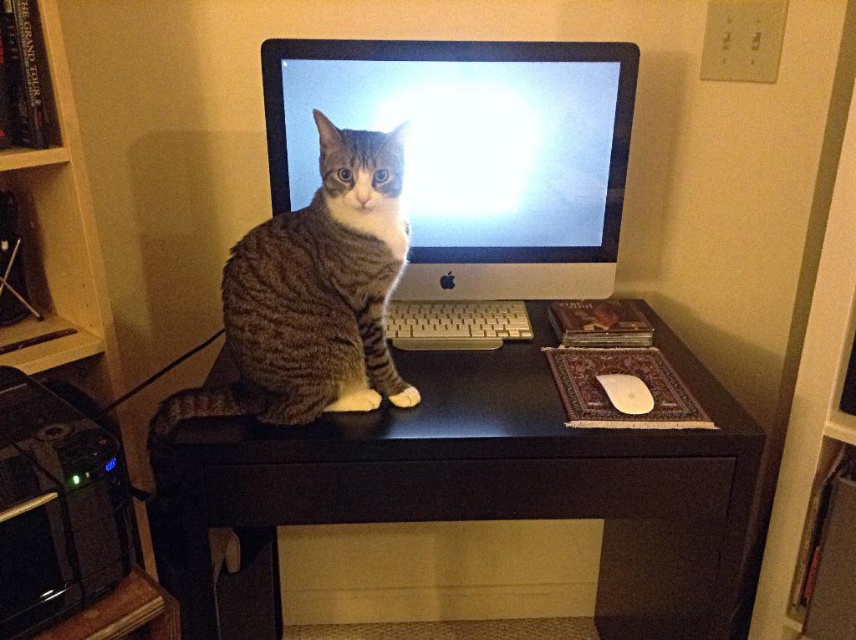
You are a photographer setting up a shot of the satin silver monitor at center and the silver metallic keyboard at center. You need to ensure that the taller object is placed in the background for depth. Which object should you place in the background?

The satin silver monitor at center is much taller than the silver metallic keyboard at center, so you should place the satin silver monitor at center in the background to create depth.

You are taking a photo of the cat on the desk. You notice two points on the desk labeled as point (536, 276) and point (233, 252). Which point is closer to the camera?

Point (536, 276) is further to the camera than point (233, 252), so point (233, 252) is closer to the camera.

You are standing in front of the desk with the cat. You want to place a new book on the desk. The book is 1.2 meters long. Can you place it from your current position to the point at coordinates point (419, 140) without the book hitting anything?

The distance between the viewer and the point (419, 140) is 1.28 meters. Since the book is 1.2 meters long, it can be placed along the path without hitting anything as the distance is sufficient.